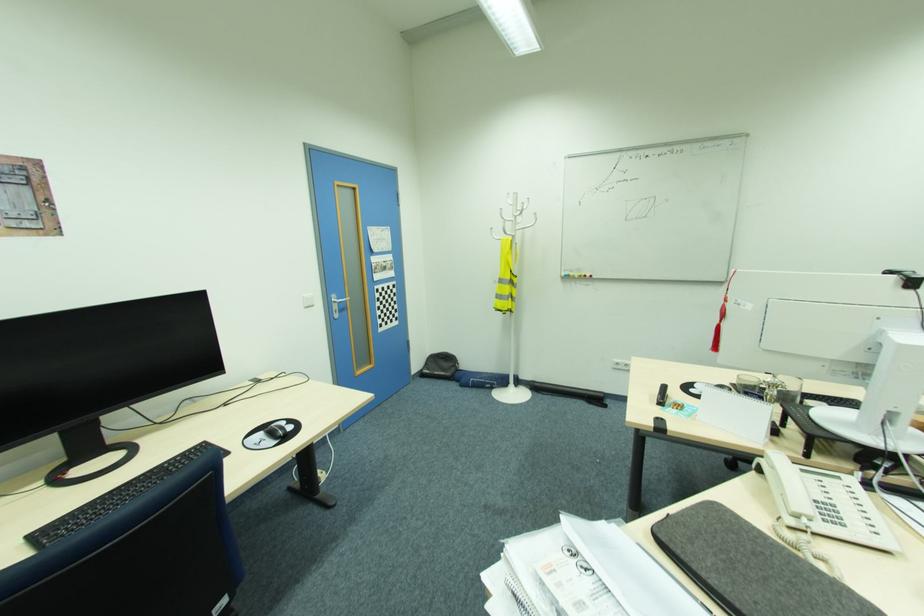
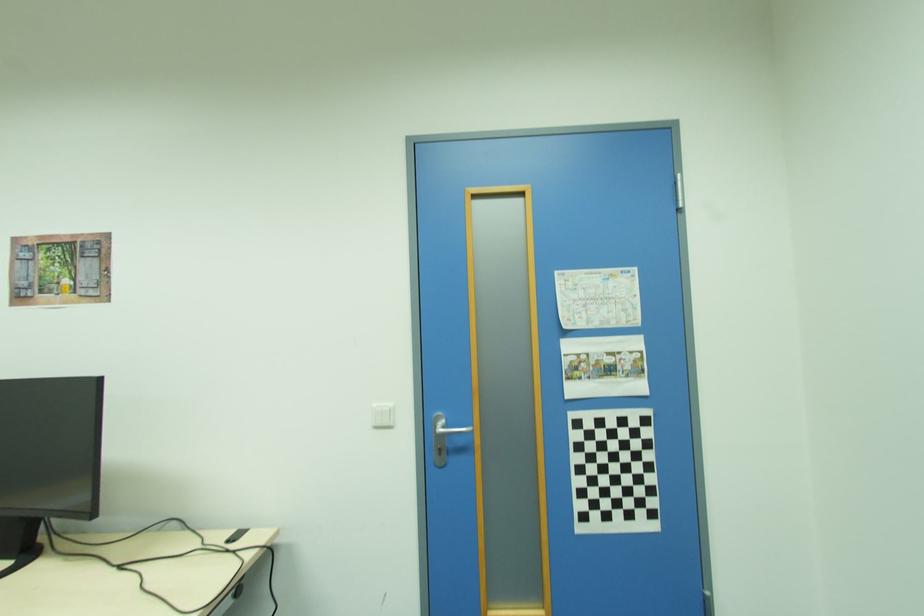
Locate, in the second image, the point that corresponds to point 383,251 in the first image.

(599, 325)